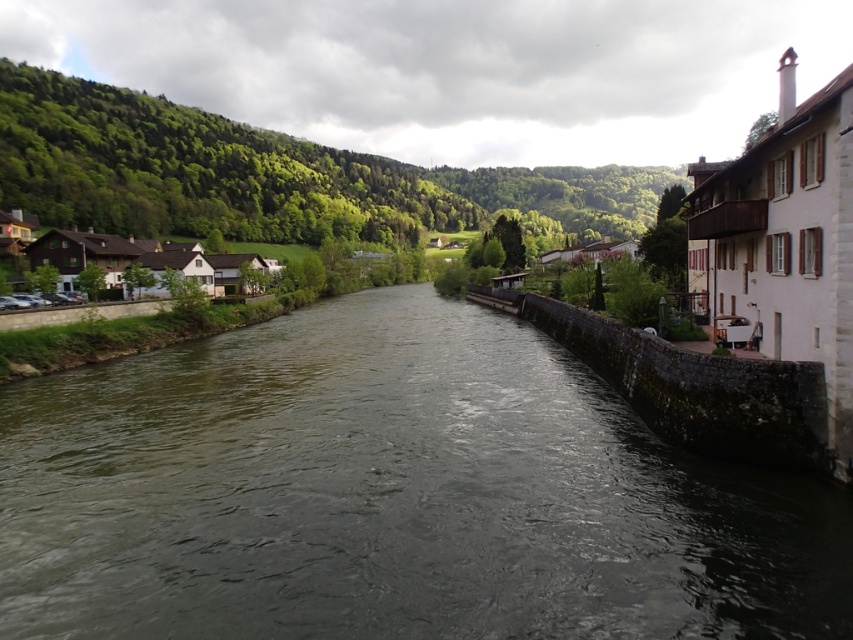
You are standing at the point with coordinates point (x=119, y=268) and want to walk towards the point (x=438, y=337). Based on the scene description, will you be moving towards the building with brown shutters or away from it?

Point (x=438, y=337) is in front of point (x=119, y=268). Since you are moving from point (x=119, y=268) towards point (x=438, y=337), you are moving towards the building with brown shutters because the destination point is closer to the building.

You are standing at the riverside and want to cross to the white stone houses at left. The dark gray concrete stream at center is in your way. Do you think you can walk across the stream to reach the houses?

The dark gray concrete stream at center is 139.26 feet away from white stone houses at left. Since the stream is between you and the houses, you would need to cross it to reach them. However, the question of whether you can walk across depends on the stream depth and width, which are not provided in the scene description. The given information only states the distance between the stream and the houses, not the stream itself.

You are standing at the origin point of the image. Which direction should you move to reach the dark gray concrete stream at center?

The dark gray concrete stream at center is located at coordinates point (392, 493), so you should move towards the right and slightly upward from your current position to reach it.